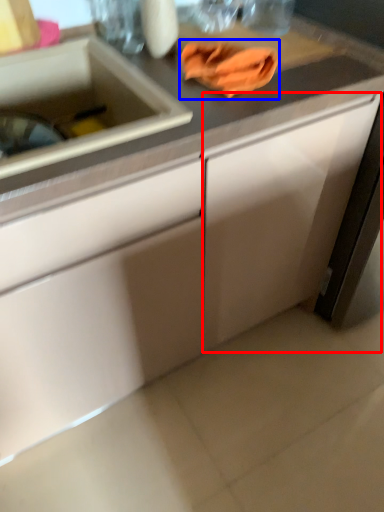
Question: Which object is further to the camera taking this photo, cabinetry (highlighted by a red box) or hand towel (highlighted by a blue box)?

Choices:
 (A) cabinetry
 (B) hand towel

Answer: (B)